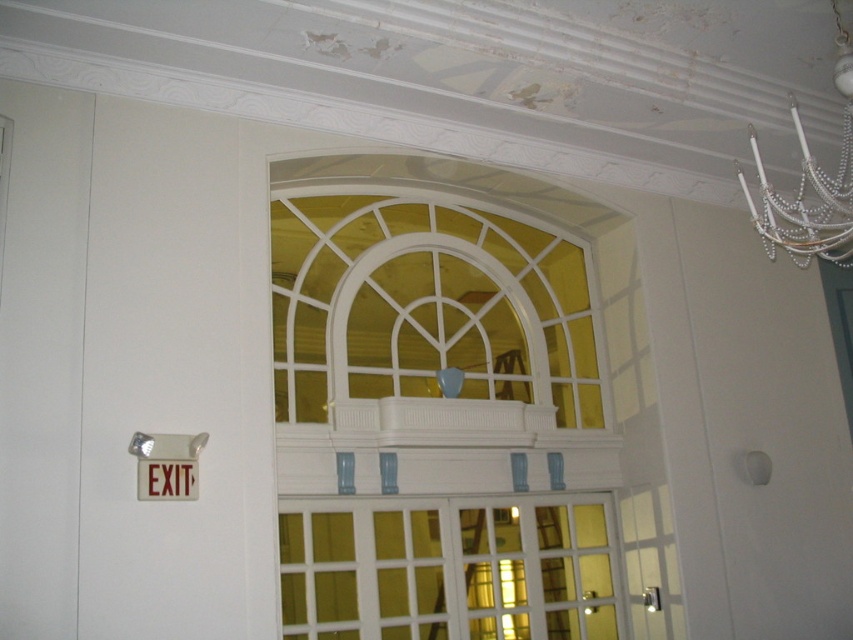
Question: Observing the image, what is the correct spatial positioning of pearl white chandelier at upper right in reference to red plastic exit sign at upper left?

Choices:
 (A) below
 (B) above

Answer: (B)

Question: Which point is farther to the camera?

Choices:
 (A) red plastic exit sign at upper left
 (B) pearl white chandelier at upper right

Answer: (A)

Question: Considering the real-world distances, which object is farthest from the white glass door at center?

Choices:
 (A) pearl white chandelier at upper right
 (B) red plastic exit sign at upper left

Answer: (A)

Question: Which object is the closest to the white glass door at center?

Choices:
 (A) pearl white chandelier at upper right
 (B) red plastic exit sign at upper left

Answer: (B)

Question: From the image, what is the correct spatial relationship of pearl white chandelier at upper right in relation to red plastic exit sign at upper left?

Choices:
 (A) left
 (B) right

Answer: (B)

Question: Where is white glass door at center located in relation to pearl white chandelier at upper right in the image?

Choices:
 (A) right
 (B) left

Answer: (B)